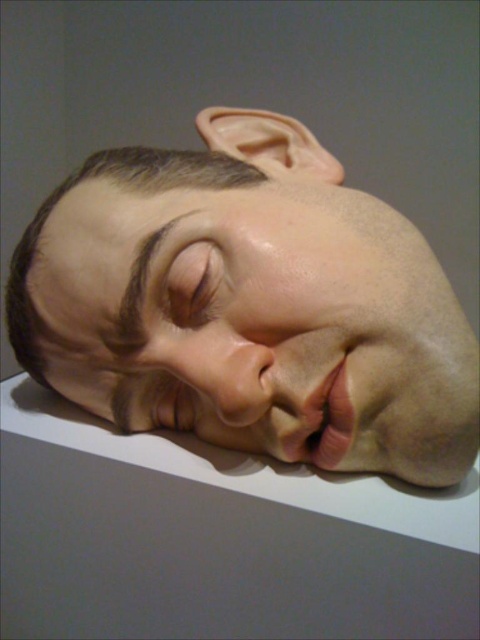
Question: Is smooth skin head at center bigger than matte flesh-colored eye at center?

Choices:
 (A) yes
 (B) no

Answer: (A)

Question: Does smooth skin head at center have a greater width compared to matte flesh-colored eye at center?

Choices:
 (A) yes
 (B) no

Answer: (A)

Question: Is smooth skin head at center closer to camera compared to matte flesh-colored eye at center?

Choices:
 (A) no
 (B) yes

Answer: (B)

Question: Which object appears closest to the camera in this image?

Choices:
 (A) smooth skin head at center
 (B) matte flesh-colored eye at center

Answer: (A)